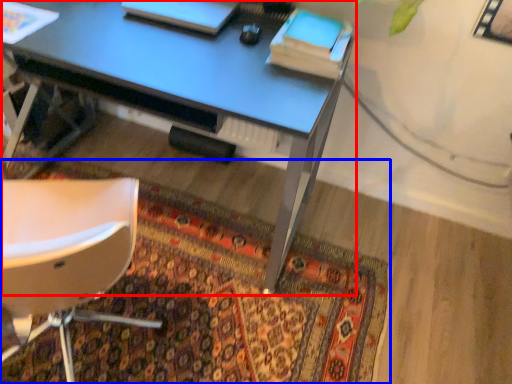
Question: Which object is further to the camera taking this photo, desk (highlighted by a red box) or mat (highlighted by a blue box)?

Choices:
 (A) desk
 (B) mat

Answer: (B)